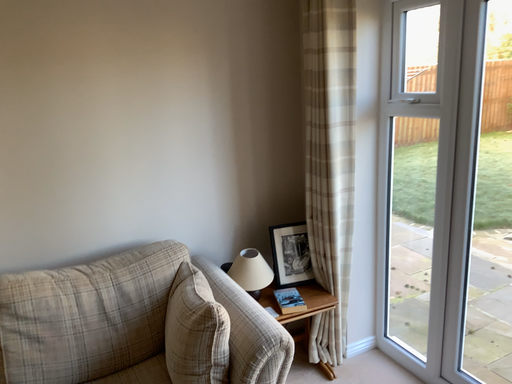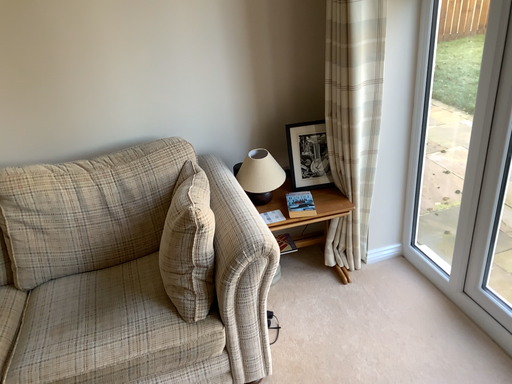
Question: How did the camera likely rotate when shooting the video?

Choices:
 (A) rotated upward
 (B) rotated downward

Answer: (B)